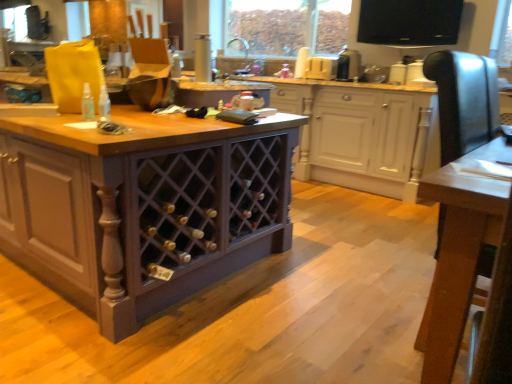
Question: From the image's perspective, is translucent plastic spray bottle at center above purple wood wine rack at center, the 1th cabinetry viewed from the back?

Choices:
 (A) no
 (B) yes

Answer: (A)

Question: From the image's perspective, does translucent plastic spray bottle at center appear lower than purple wood wine rack at center, the 1th cabinetry viewed from the back?

Choices:
 (A) yes
 (B) no

Answer: (A)

Question: Is translucent plastic spray bottle at center positioned behind purple wood wine rack at center, the second cabinetry positioned from the front?

Choices:
 (A) no
 (B) yes

Answer: (A)

Question: Is translucent plastic spray bottle at center bigger than purple wood wine rack at center, the second cabinetry positioned from the front?

Choices:
 (A) no
 (B) yes

Answer: (A)

Question: Are translucent plastic spray bottle at center and purple wood wine rack at center, the 1th cabinetry viewed from the back, making contact?

Choices:
 (A) yes
 (B) no

Answer: (B)

Question: Is wooden table at center to the left or to the right of purple wood wine rack at center, the 1th cabinetry viewed from the back, in the image?

Choices:
 (A) right
 (B) left

Answer: (A)

Question: In terms of size, does wooden table at center appear bigger or smaller than purple wood wine rack at center, the second cabinetry positioned from the front?

Choices:
 (A) big
 (B) small

Answer: (B)

Question: Considering the positions of wooden table at center and purple wood wine rack at center, the 1th cabinetry viewed from the back, in the image, is wooden table at center wider or thinner than purple wood wine rack at center, the 1th cabinetry viewed from the back,?

Choices:
 (A) wide
 (B) thin

Answer: (B)

Question: From a real-world perspective, is wooden table at center physically located above or below purple wood wine rack at center, the second cabinetry positioned from the front?

Choices:
 (A) above
 (B) below

Answer: (B)

Question: Considering the positions of point (86, 104) and point (352, 69), is point (86, 104) closer or farther from the camera than point (352, 69)?

Choices:
 (A) closer
 (B) farther

Answer: (A)

Question: In terms of height, does translucent plastic spray bottle at center look taller or shorter compared to black plastic toaster at upper center?

Choices:
 (A) short
 (B) tall

Answer: (A)

Question: In the image, is translucent plastic spray bottle at center on the left side or the right side of black plastic toaster at upper center?

Choices:
 (A) left
 (B) right

Answer: (A)

Question: From the image's perspective, is translucent plastic spray bottle at center positioned above or below black plastic toaster at upper center?

Choices:
 (A) above
 (B) below

Answer: (B)

Question: From a real-world perspective, relative to black plastic toaster at upper center, is purple wood wine rack at center, which appears as the second cabinetry when viewed from the back, vertically above or below?

Choices:
 (A) above
 (B) below

Answer: (B)

Question: Considering the relative positions of purple wood wine rack at center, which appears as the second cabinetry when viewed from the back, and black plastic toaster at upper center in the image provided, is purple wood wine rack at center, which appears as the second cabinetry when viewed from the back, to the left or to the right of black plastic toaster at upper center?

Choices:
 (A) right
 (B) left

Answer: (B)